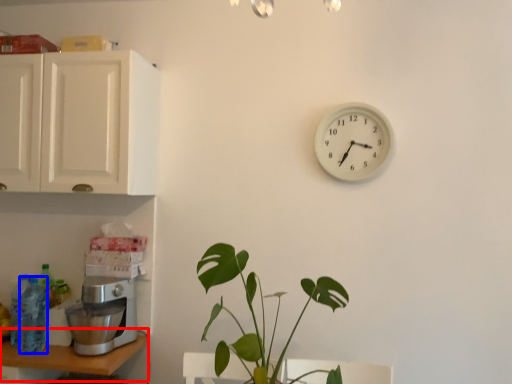
Question: Which object appears closest to the camera in this image, table (highlighted by a red box) or bottle (highlighted by a blue box)?

Choices:
 (A) table
 (B) bottle

Answer: (A)